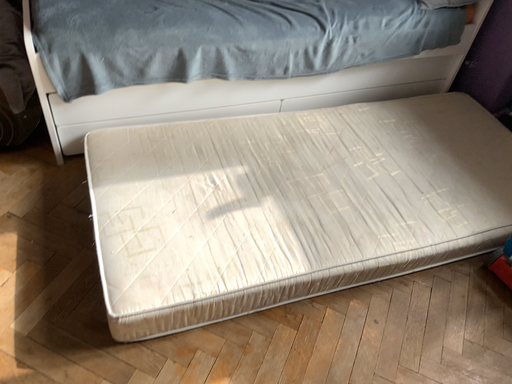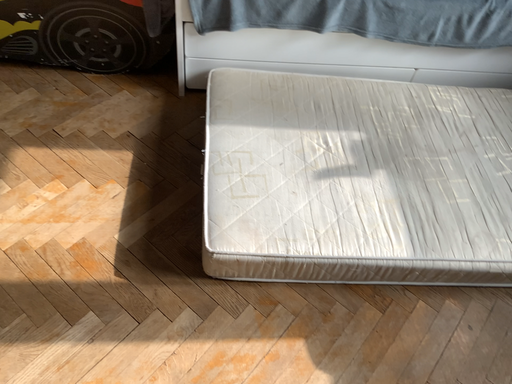
Question: Which way did the camera rotate in the video?

Choices:
 (A) rotated left
 (B) rotated right

Answer: (A)